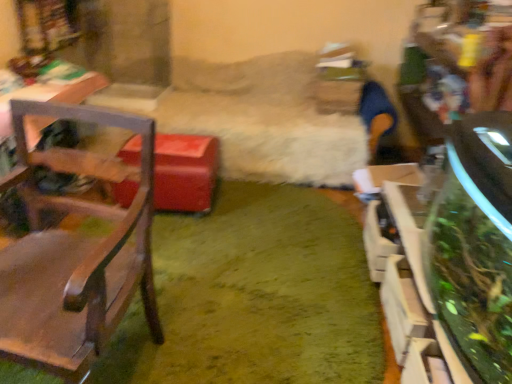
The height and width of the screenshot is (384, 512). Identify the location of vacant area situated below green plush carpet at center (from a real-world perspective). (260, 293).